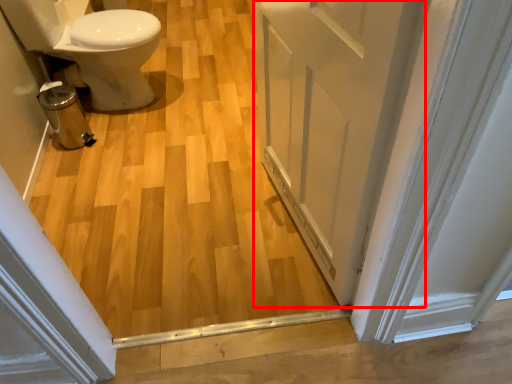
Question: From the image's perspective, what is the correct spatial positioning of door (annotated by the red box) in reference to bidet?

Choices:
 (A) above
 (B) below

Answer: (B)